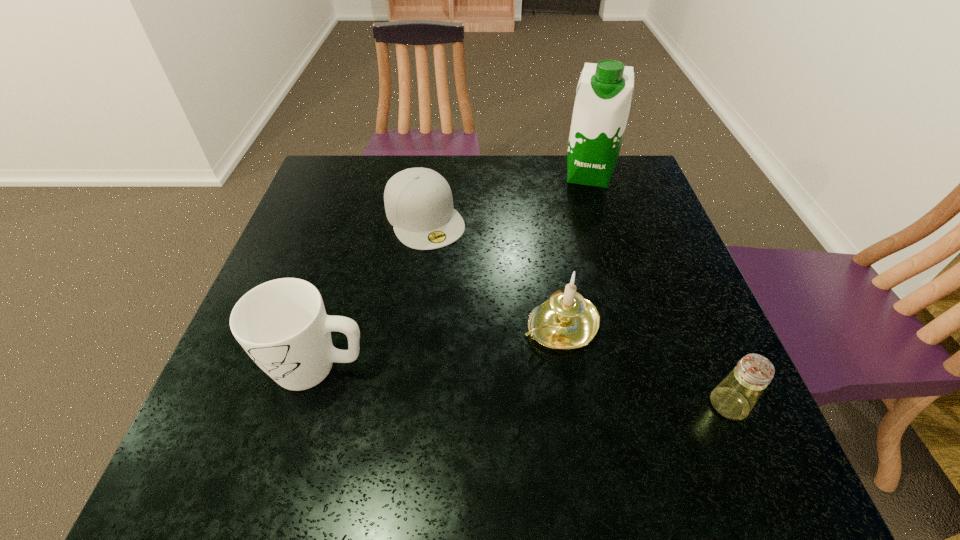
Image resolution: width=960 pixels, height=540 pixels. In order to click on vacant space located on the front-facing side of the shortest object in this screenshot , I will do `click(502, 347)`.

Locate an element on the screen. Image resolution: width=960 pixels, height=540 pixels. free space located on the front-facing side of the shortest object is located at coordinates (514, 366).

The image size is (960, 540). What are the coordinates of `vacant region located 0.110m on the front-facing side of the shortest object` in the screenshot? It's located at (458, 276).

You are a GUI agent. You are given a task and a screenshot of the screen. Output one action in this format:
    pyautogui.click(x=<x>, y=<y>)
    Task: Click on the vacant area situated 0.300m on the front-facing side of the soya milk
    This screenshot has height=540, width=960.
    Given the screenshot: What is the action you would take?
    pyautogui.click(x=578, y=260)

Locate an element on the screen. The height and width of the screenshot is (540, 960). vacant region located 0.230m on the front-facing side of the soya milk is located at coordinates (580, 241).

Where is `free space located 0.380m on the front-facing side of the soya milk`? free space located 0.380m on the front-facing side of the soya milk is located at coordinates pyautogui.click(x=575, y=284).

Where is `cap that is positioned at the far edge`? Image resolution: width=960 pixels, height=540 pixels. cap that is positioned at the far edge is located at coordinates (418, 202).

At what (x,y) coordinates should I click in order to perform the action: click on soya milk at the far edge. Please return your answer as a coordinate pair (x, y). The width and height of the screenshot is (960, 540). Looking at the image, I should click on (602, 104).

Locate an element on the screen. mug located in the near edge section of the desktop is located at coordinates (282, 324).

At what (x,y) coordinates should I click in order to perform the action: click on saltshaker that is positioned at the near edge. Please return your answer as a coordinate pair (x, y). Looking at the image, I should click on (734, 397).